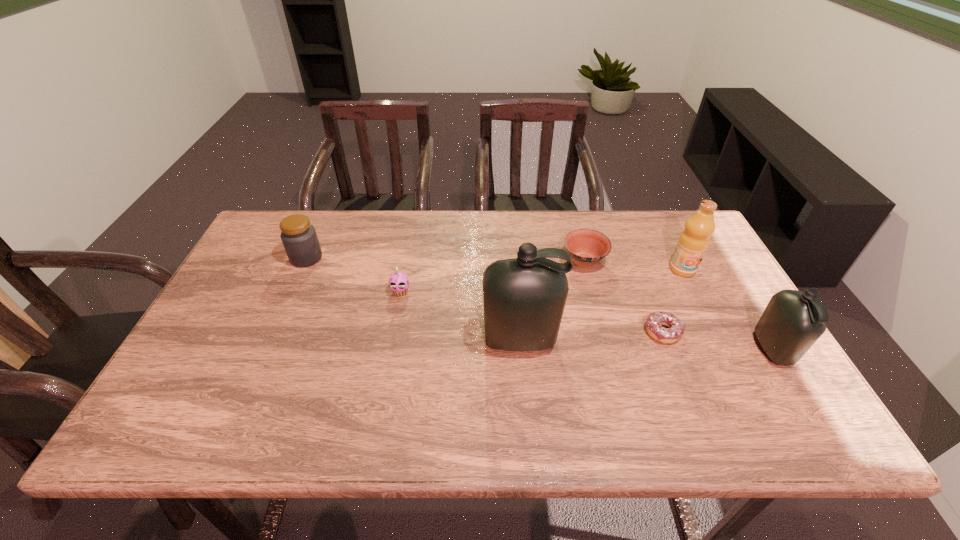
Identify the location of bowl that is at the far edge. The width and height of the screenshot is (960, 540). (586, 247).

You are a GUI agent. You are given a task and a screenshot of the screen. Output one action in this format:
    pyautogui.click(x=<x>, y=<y>)
    Task: Click on the jar present at the far edge
    The height and width of the screenshot is (540, 960).
    Given the screenshot: What is the action you would take?
    pyautogui.click(x=299, y=238)

Where is `object located in the near edge section of the desktop`? object located in the near edge section of the desktop is located at coordinates (793, 321).

I want to click on object present at the left edge, so click(x=299, y=238).

This screenshot has width=960, height=540. I want to click on bottle that is at the right edge, so click(793, 321).

The height and width of the screenshot is (540, 960). Find the location of `fruit juice at the right edge`. fruit juice at the right edge is located at coordinates pos(694,240).

Find the location of a particular element. This screenshot has height=540, width=960. object at the far left corner is located at coordinates (299, 238).

Locate an element on the screen. The image size is (960, 540). object present at the near right corner is located at coordinates (793, 321).

This screenshot has width=960, height=540. Identify the location of vacant space at the far edge of the desktop. (444, 218).

Find the location of a particular element. vacant region at the near edge of the desktop is located at coordinates (685, 386).